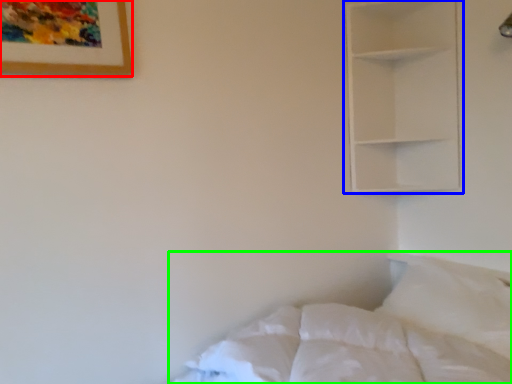
Question: Estimate the real-world distances between objects in this image. Which object is closer to picture frame (highlighted by a red box), shelf (highlighted by a blue box) or bed (highlighted by a green box)?

Choices:
 (A) shelf
 (B) bed

Answer: (B)